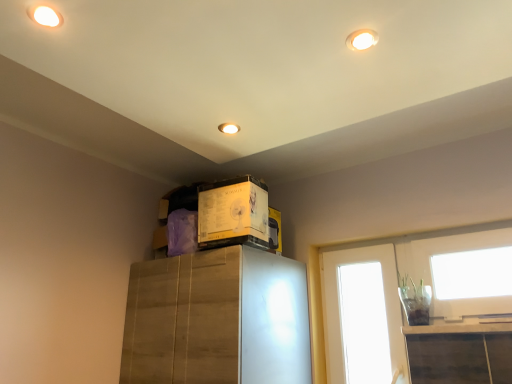
Question: From a real-world perspective, is yellow cardboard box at upper center on top of white glossy door at upper right?

Choices:
 (A) yes
 (B) no

Answer: (A)

Question: From the image's perspective, is yellow cardboard box at upper center on top of white glossy door at upper right?

Choices:
 (A) yes
 (B) no

Answer: (A)

Question: Is yellow cardboard box at upper center looking in the opposite direction of white glossy door at upper right?

Choices:
 (A) yes
 (B) no

Answer: (B)

Question: Is yellow cardboard box at upper center thinner than white glossy door at upper right?

Choices:
 (A) no
 (B) yes

Answer: (A)

Question: Considering the relative sizes of yellow cardboard box at upper center and white glossy door at upper right in the image provided, is yellow cardboard box at upper center smaller than white glossy door at upper right?

Choices:
 (A) no
 (B) yes

Answer: (A)

Question: Considering the relative sizes of yellow cardboard box at upper center and white glossy door at upper right in the image provided, is yellow cardboard box at upper center shorter than white glossy door at upper right?

Choices:
 (A) yes
 (B) no

Answer: (A)

Question: Considering the relative positions of white glossy door at upper right and yellow cardboard box at upper center in the image provided, is white glossy door at upper right to the left of yellow cardboard box at upper center from the viewer's perspective?

Choices:
 (A) yes
 (B) no

Answer: (B)

Question: Is white glossy door at upper right turned away from yellow cardboard box at upper center?

Choices:
 (A) no
 (B) yes

Answer: (A)

Question: Considering the relative sizes of white glossy door at upper right and yellow cardboard box at upper center in the image provided, is white glossy door at upper right bigger than yellow cardboard box at upper center?

Choices:
 (A) yes
 (B) no

Answer: (B)

Question: From the image's perspective, does white glossy door at upper right appear higher than yellow cardboard box at upper center?

Choices:
 (A) no
 (B) yes

Answer: (A)

Question: Considering the relative sizes of white glossy door at upper right and yellow cardboard box at upper center in the image provided, is white glossy door at upper right shorter than yellow cardboard box at upper center?

Choices:
 (A) no
 (B) yes

Answer: (A)

Question: Is white glossy door at upper right facing towards yellow cardboard box at upper center?

Choices:
 (A) yes
 (B) no

Answer: (A)

Question: Looking at their shapes, would you say yellow cardboard box at upper center is wider or thinner than white glossy door at upper right?

Choices:
 (A) thin
 (B) wide

Answer: (B)